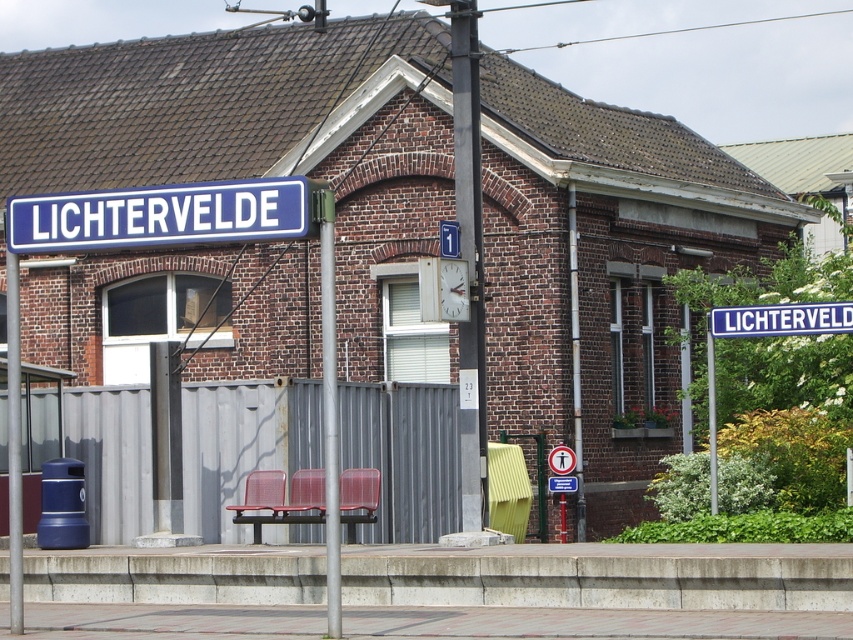
Question: Which point is farther from the camera taking this photo?

Choices:
 (A) (222, 211)
 (B) (782, 305)

Answer: (B)

Question: Is blue metallic signboard at upper left wider than silver metallic pole at center?

Choices:
 (A) no
 (B) yes

Answer: (B)

Question: Considering the real-world distances, which object is closest to the blue metallic signboard at upper left?

Choices:
 (A) silver metallic pole at center
 (B) metallic pole at center
 (C) blue metallic signboard at upper center

Answer: (A)

Question: Is blue metallic signboard at upper left below metallic pole at center?

Choices:
 (A) no
 (B) yes

Answer: (A)

Question: Which point is farther to the camera?

Choices:
 (A) blue metallic signboard at upper center
 (B) blue metallic signboard at upper left
 (C) metallic pole at center
 (D) silver metallic pole at center

Answer: (A)

Question: Where is blue metallic signboard at upper left located in relation to silver metallic pole at center in the image?

Choices:
 (A) above
 (B) below

Answer: (A)